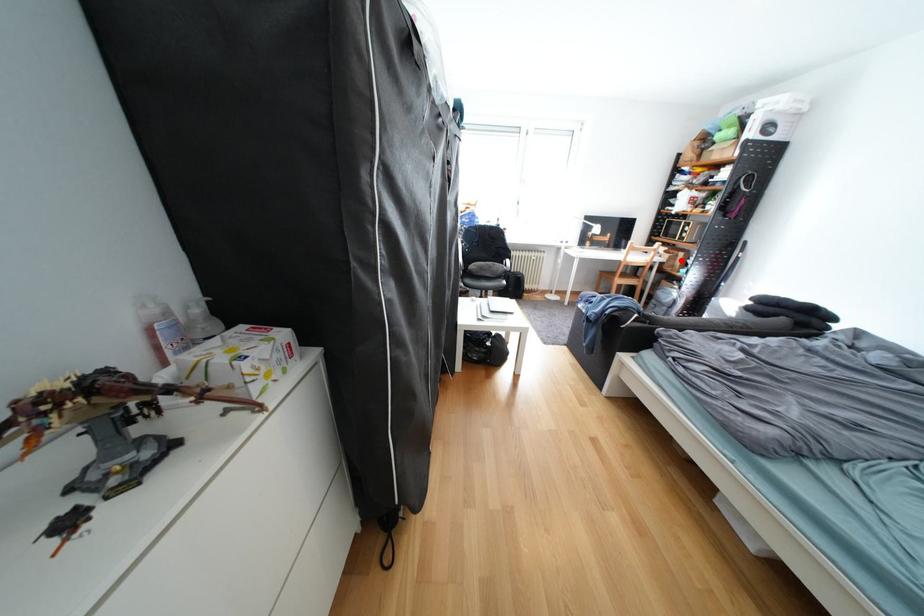
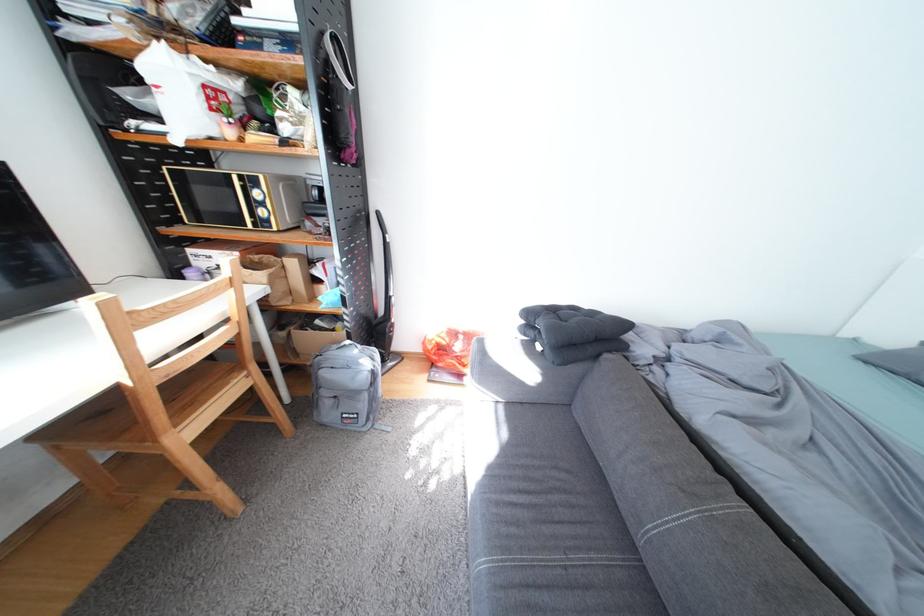
Find the pixel in the second image that matches the highlighted location in the first image.

(285, 284)